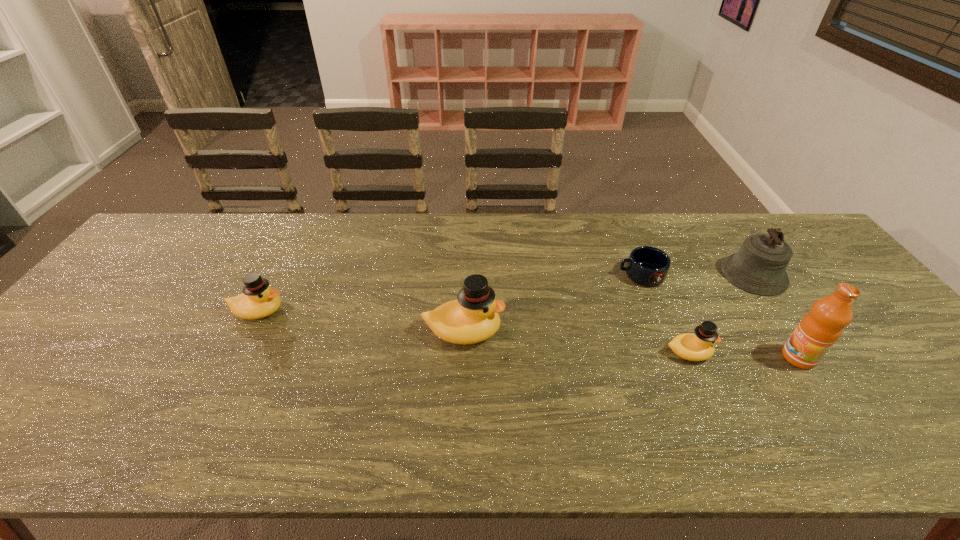
Locate an element on the screen. The image size is (960, 540). the fourth tallest object is located at coordinates (258, 300).

This screenshot has height=540, width=960. In order to click on the second tallest duck in this screenshot , I will do `click(258, 300)`.

Identify the location of the second duck from left to right. This screenshot has height=540, width=960. (473, 318).

This screenshot has height=540, width=960. What are the coordinates of `the tallest duck` in the screenshot? It's located at (473, 318).

Where is `the second shortest object`? the second shortest object is located at coordinates (694, 347).

The height and width of the screenshot is (540, 960). What are the coordinates of `the rightmost duck` in the screenshot? It's located at coord(694,347).

Locate an element on the screen. mug is located at coordinates (648, 266).

Locate an element on the screen. This screenshot has width=960, height=540. bell is located at coordinates (759, 267).

Identify the location of the tallest object. (817, 332).

At what (x,y) coordinates should I click in order to perform the action: click on vacant space located on the front-facing side of the second shortest duck. Please return your answer as a coordinate pair (x, y). Looking at the image, I should click on (422, 311).